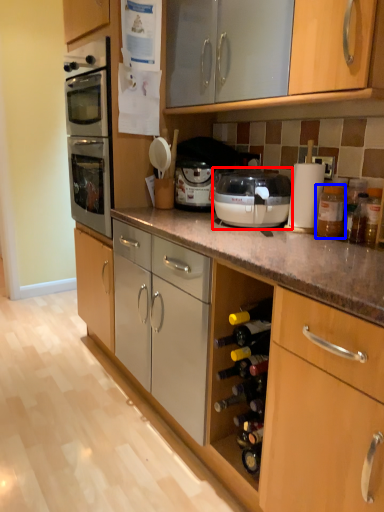
Question: Which object appears closest to the camera in this image, kitchen appliance (highlighted by a red box) or bottle (highlighted by a blue box)?

Choices:
 (A) kitchen appliance
 (B) bottle

Answer: (A)